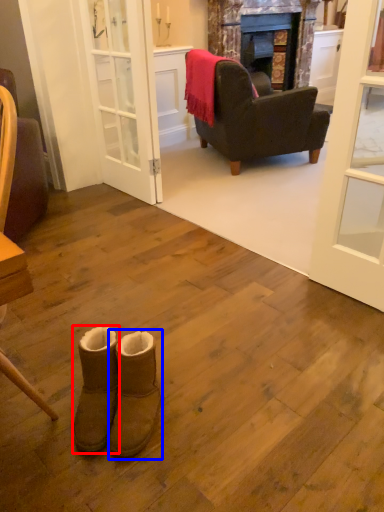
Question: Among these objects, which one is farthest to the camera, footwear (highlighted by a red box) or footwear (highlighted by a blue box)?

Choices:
 (A) footwear
 (B) footwear

Answer: (A)